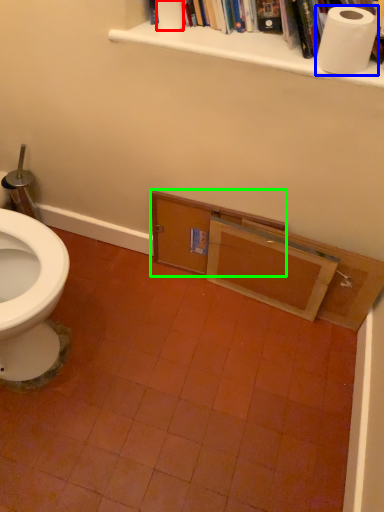
Question: Based on their relative distances, which object is nearer to toilet paper (highlighted by a red box)? Choose from toilet paper (highlighted by a blue box) and drawer (highlighted by a green box).

Choices:
 (A) toilet paper
 (B) drawer

Answer: (A)